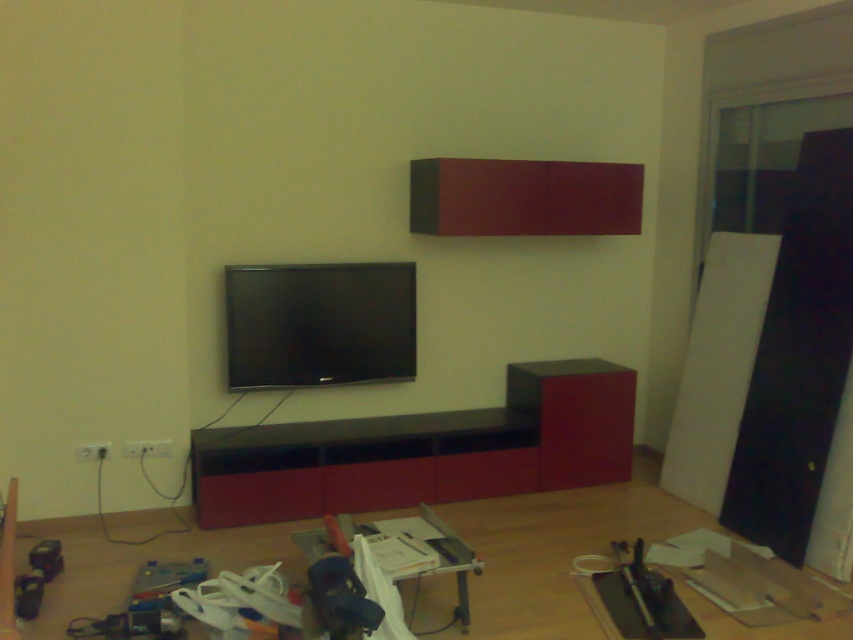
Question: Does matte black entertainment center at center have a lesser width compared to black glossy flat screen tv at center?

Choices:
 (A) no
 (B) yes

Answer: (A)

Question: Which object is farther from the camera taking this photo?

Choices:
 (A) matte black entertainment center at center
 (B) black glossy flat screen tv at center

Answer: (B)

Question: Which of the following is the farthest from the observer?

Choices:
 (A) matte black entertainment center at center
 (B) black glossy flat screen tv at center

Answer: (B)

Question: Does matte black entertainment center at center appear on the left side of black glossy flat screen tv at center?

Choices:
 (A) no
 (B) yes

Answer: (A)

Question: Can you confirm if matte black entertainment center at center is positioned below black glossy flat screen tv at center?

Choices:
 (A) yes
 (B) no

Answer: (A)